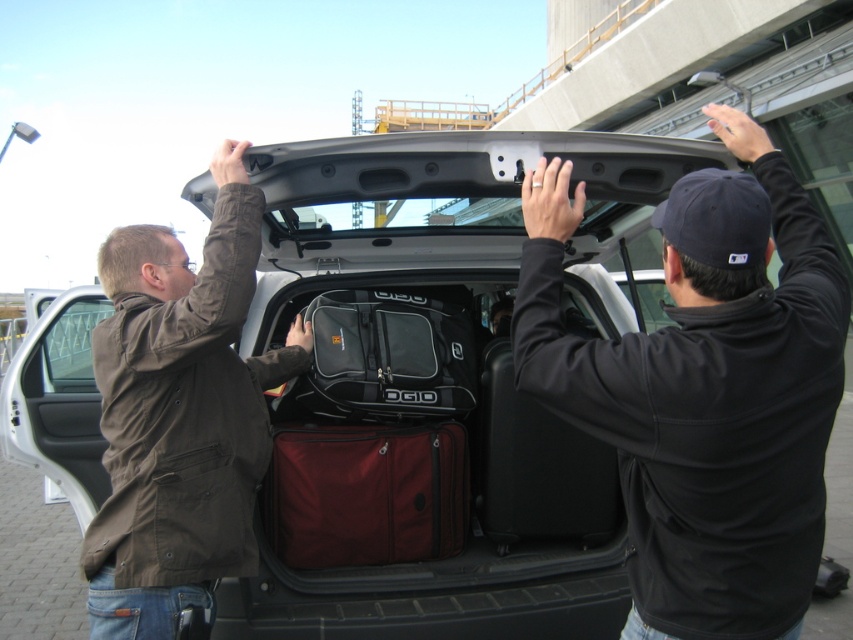
Question: Where is black matte luggage at center located in relation to brown fabric jacket at center in the image?

Choices:
 (A) left
 (B) right

Answer: (B)

Question: Estimate the real-world distances between objects in this image. Which object is closer to the brown fabric jacket at center?

Choices:
 (A) black matte jacket at upper center
 (B) black matte suitcase at center
 (C) matte red suitcase at center

Answer: (C)

Question: Is brown fabric jacket at center to the right of black matte suitcase at center from the viewer's perspective?

Choices:
 (A) no
 (B) yes

Answer: (A)

Question: Which of the following is the farthest from the observer?

Choices:
 (A) (398, 504)
 (B) (225, 637)
 (C) (184, 328)

Answer: (A)

Question: Which of the following is the closest to the observer?

Choices:
 (A) black matte jacket at upper center
 (B) black matte luggage at center
 (C) brown fabric jacket at center

Answer: (A)

Question: Is matte red suitcase at center wider than black matte suitcase at center?

Choices:
 (A) no
 (B) yes

Answer: (B)